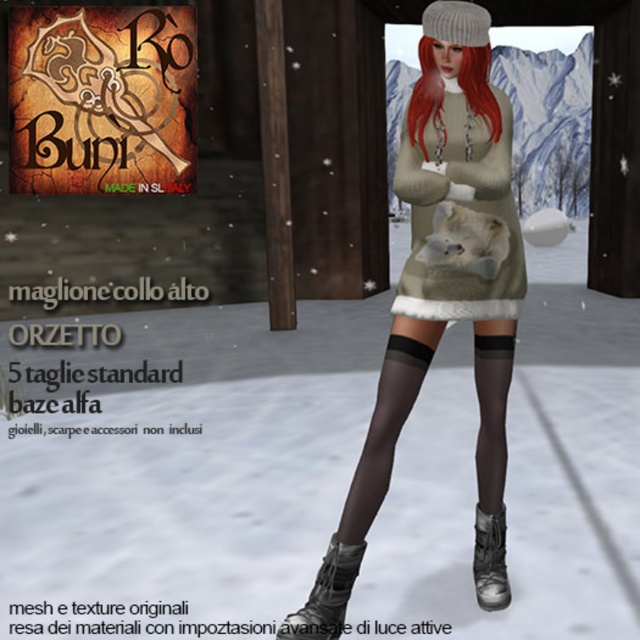
You are a fashion designer who wants to create a new winter outfit. You have the fuzzy beige sweater at center and the matte black boot at lower center in your design. Which item would you need to adjust in size to ensure they proportionally match each other?

The fuzzy beige sweater at center is larger than the matte black boot at lower center. To ensure proportional matching, you would need to either reduce the size of the fuzzy beige sweater at center or increase the size of the matte black boot at lower center.

You are trying to determine the relative positions of the fuzzy beige sweater at center and the matte black boot at lower center in the snowy scene. Based on their sizes, which object appears larger in the image?

The fuzzy beige sweater at center appears larger than the matte black boot at lower center because it is taller than the boot.